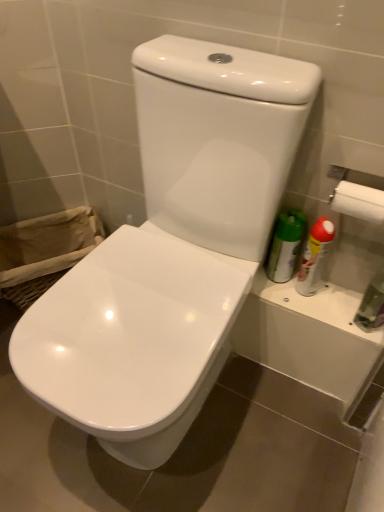
Where is `burlap laundry basket at lower left`? This screenshot has height=512, width=384. burlap laundry basket at lower left is located at coordinates (44, 252).

Measure the distance between white plastic spray can at right and camera.

A distance of 37.10 inches exists between white plastic spray can at right and camera.

What do you see at coordinates (315, 257) in the screenshot? I see `white plastic spray can at right` at bounding box center [315, 257].

Find the location of a particular element. The width and height of the screenshot is (384, 512). burlap laundry basket at lower left is located at coordinates (44, 252).

Which of these two, burlap laundry basket at lower left or white plastic spray can at right, is smaller?

white plastic spray can at right is smaller.

Find the location of a particular element. The height and width of the screenshot is (512, 384). laundry basket below the white plastic spray can at right (from the image's perspective) is located at coordinates (44, 252).

In the image, is burlap laundry basket at lower left positioned in front of or behind white plastic spray can at right?

burlap laundry basket at lower left is behind white plastic spray can at right.

Is white plastic spray can at right completely or partially inside white glossy toilet at center, the 2th toilet viewed from the right?

No, white glossy toilet at center, the 2th toilet viewed from the right, does not contain white plastic spray can at right.

Looking at this image, does white glossy toilet at center, the 2th toilet viewed from the right, appear on the left side of white plastic spray can at right?

Correct, you'll find white glossy toilet at center, the 2th toilet viewed from the right, to the left of white plastic spray can at right.

Is white glossy toilet at center, the 2th toilet viewed from the right, thinner than white plastic spray can at right?

No, white glossy toilet at center, the 2th toilet viewed from the right, is not thinner than white plastic spray can at right.

Find the location of a particular element. The width and height of the screenshot is (384, 512). cleaning product behind the white glossy toilet at center, the 2th toilet viewed from the right is located at coordinates (315, 257).

Which point is more distant from viewer, (x=303, y=259) or (x=362, y=326)?

The point (x=303, y=259) is farther from the camera.

Is white plastic spray can at right situated inside transparent plastic bottle at right or outside?

white plastic spray can at right is located beyond the bounds of transparent plastic bottle at right.

Can you tell me how much white plastic spray can at right and transparent plastic bottle at right differ in facing direction?

0.00099 degrees separate the facing orientations of white plastic spray can at right and transparent plastic bottle at right.

Is white plastic spray can at right looking in the opposite direction of white glossy toilet at center, acting as the first toilet starting from the left?

white plastic spray can at right is not turned away from white glossy toilet at center, acting as the first toilet starting from the left.

Does white plastic spray can at right have a greater width compared to white glossy toilet at center, acting as the first toilet starting from the left?

In fact, white plastic spray can at right might be narrower than white glossy toilet at center, acting as the first toilet starting from the left.

Between white plastic spray can at right and white glossy toilet at center, the 2th toilet viewed from the right, which one appears on the left side from the viewer's perspective?

From the viewer's perspective, white glossy toilet at center, the 2th toilet viewed from the right, appears more on the left side.

Is white plastic spray can at right bigger or smaller than white glossy toilet at center, the 2th toilet viewed from the right?

Clearly, white plastic spray can at right is smaller in size than white glossy toilet at center, the 2th toilet viewed from the right.

Does point (54, 282) appear closer or farther from the camera than point (115, 338)?

Point (54, 282) is farther from the camera than point (115, 338).

You are a GUI agent. You are given a task and a screenshot of the screen. Output one action in this format:
    pyautogui.click(x=<x>, y=<y>)
    Task: Click on the toilet that is the 1st object to the right of the burlap laundry basket at lower left, starting at the anchor
    This screenshot has height=512, width=384.
    Given the screenshot: What is the action you would take?
    pyautogui.click(x=132, y=340)

Considering the relative sizes of burlap laundry basket at lower left and white glossy toilet at center, the 2th toilet viewed from the right, in the image provided, is burlap laundry basket at lower left shorter than white glossy toilet at center, the 2th toilet viewed from the right,?

In fact, burlap laundry basket at lower left may be taller than white glossy toilet at center, the 2th toilet viewed from the right.

Is burlap laundry basket at lower left oriented towards white glossy toilet at center, the 2th toilet viewed from the right?

Yes.

Is white plastic spray can at right positioned behind white glossy toilet at center, placed as the second toilet when sorted from left to right?

Yes, the depth of white plastic spray can at right is greater than that of white glossy toilet at center, placed as the second toilet when sorted from left to right.

Is white plastic spray can at right thinner than white glossy toilet at center, the first toilet from the right?

Yes, white plastic spray can at right is thinner than white glossy toilet at center, the first toilet from the right.

Is point (315, 243) closer or farther from the camera than point (280, 146)?

Point (315, 243) appears to be farther away from the viewer than point (280, 146).

Considering the sizes of objects transparent plastic bottle at right and white plastic spray can at right in the image provided, who is thinner, transparent plastic bottle at right or white plastic spray can at right?

white plastic spray can at right.

Which is behind, point (375, 317) or point (319, 278)?

Positioned behind is point (319, 278).

Considering the sizes of objects transparent plastic bottle at right and white plastic spray can at right in the image provided, who is smaller, transparent plastic bottle at right or white plastic spray can at right?

With smaller size is white plastic spray can at right.

Based on the photo, from a real-world perspective, is transparent plastic bottle at right positioned above or below white plastic spray can at right?

In terms of real-world spatial position, transparent plastic bottle at right is above white plastic spray can at right.

The image size is (384, 512). I want to click on cleaning product located in front of the burlap laundry basket at lower left, so click(315, 257).

Locate an element on the screen. cleaning product located on the right of white glossy toilet at center, the 2th toilet viewed from the right is located at coordinates (315, 257).

In the scene shown: Looking at the image, which one is located further to white glossy toilet at center, acting as the first toilet starting from the left, burlap laundry basket at lower left or white plastic spray can at right?

The object further to white glossy toilet at center, acting as the first toilet starting from the left, is white plastic spray can at right.

Based on their spatial positions, is transparent plastic bottle at right or white plastic spray can at right further from white glossy toilet at center, acting as the first toilet starting from the left?

transparent plastic bottle at right lies further to white glossy toilet at center, acting as the first toilet starting from the left, than the other object.

From the image, which object appears to be farther from white glossy toilet at center, acting as the first toilet starting from the left, burlap laundry basket at lower left or transparent plastic bottle at right?

Based on the image, transparent plastic bottle at right appears to be further to white glossy toilet at center, acting as the first toilet starting from the left.

Based on their spatial positions, is white glossy toilet at center, the first toilet from the right, or white plastic spray can at right further from white glossy toilet at center, acting as the first toilet starting from the left?

Based on the image, white plastic spray can at right appears to be further to white glossy toilet at center, acting as the first toilet starting from the left.

Looking at the image, which one is located closer to burlap laundry basket at lower left, white glossy toilet at center, placed as the second toilet when sorted from left to right, or white plastic spray can at right?

Among the two, white glossy toilet at center, placed as the second toilet when sorted from left to right, is located nearer to burlap laundry basket at lower left.

Consider the image. Looking at the image, which one is located closer to white plastic spray can at right, burlap laundry basket at lower left or white glossy toilet at center, the first toilet from the right?

white glossy toilet at center, the first toilet from the right, is closer to white plastic spray can at right.

From the image, which object appears to be nearer to white glossy toilet at center, the first toilet from the right, burlap laundry basket at lower left or white plastic spray can at right?

white plastic spray can at right.

Based on their spatial positions, is transparent plastic bottle at right or white glossy toilet at center, the 2th toilet viewed from the right, closer to burlap laundry basket at lower left?

white glossy toilet at center, the 2th toilet viewed from the right, is closer to burlap laundry basket at lower left.

Where is `cleaning product located between white glossy toilet at center, placed as the second toilet when sorted from left to right, and burlap laundry basket at lower left in the depth direction`? This screenshot has height=512, width=384. cleaning product located between white glossy toilet at center, placed as the second toilet when sorted from left to right, and burlap laundry basket at lower left in the depth direction is located at coordinates (315, 257).

Locate an element on the screen. Image resolution: width=384 pixels, height=512 pixels. toilet between white glossy toilet at center, acting as the first toilet starting from the left, and transparent plastic bottle at right is located at coordinates (171, 250).

This screenshot has width=384, height=512. What are the coordinates of `cleaning product between burlap laundry basket at lower left and transparent plastic bottle at right` in the screenshot? It's located at (315, 257).

Identify the location of toilet positioned between white glossy toilet at center, placed as the second toilet when sorted from left to right, and burlap laundry basket at lower left from near to far. (132, 340).